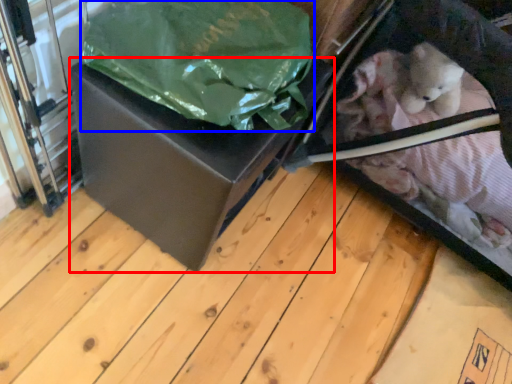
Question: Which object appears farthest to the camera in this image, box (highlighted by a red box) or plastic bag (highlighted by a blue box)?

Choices:
 (A) box
 (B) plastic bag

Answer: (A)